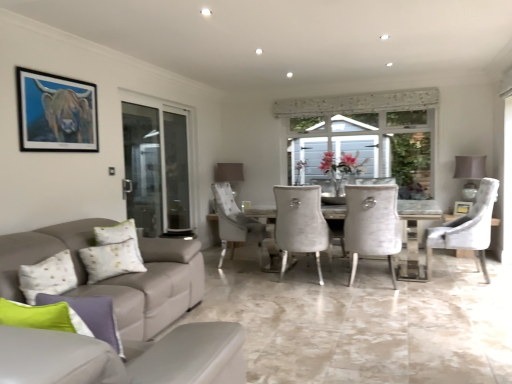
Where is `free point above matte black frame at upper left, the first picture frame viewed from the front (from a real-world perspective)`? Image resolution: width=512 pixels, height=384 pixels. free point above matte black frame at upper left, the first picture frame viewed from the front (from a real-world perspective) is located at coordinates (58, 75).